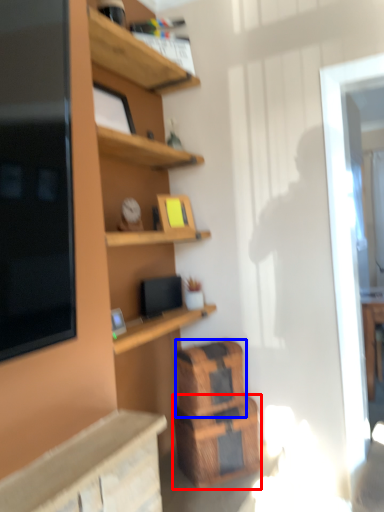
Question: Among these objects, which one is farthest to the camera, crate (highlighted by a red box) or crate (highlighted by a blue box)?

Choices:
 (A) crate
 (B) crate

Answer: (B)